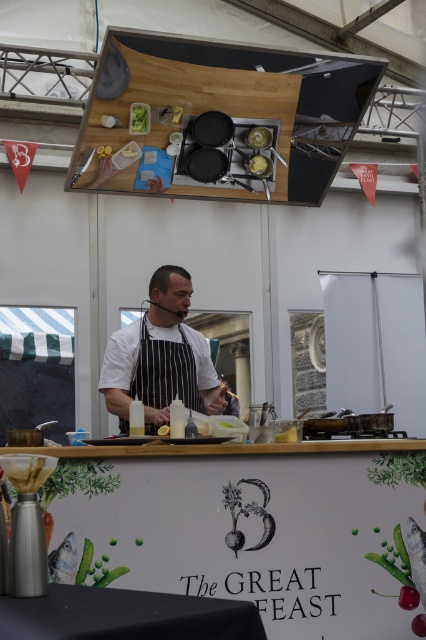
You are a chef at The Great Feast event. You need to place a new ingredient between the yellow matte cheese at upper center and the yellow matte lemon at center. Where should you place it to ensure it is between them?

The yellow matte cheese at upper center is positioned on the right side of yellow matte lemon at center, so you should place the new ingredient to the left of the cheese and to the right of the lemon to ensure it is between them.

You are attending The Great Feast event and notice the white striped apron at center. Where exactly is it positioned in relation to the chef and the counter?

The white striped apron at center is located at coordinates point (161, 356), which places it centrally on the chef who is standing behind the counter during the cooking demonstration.